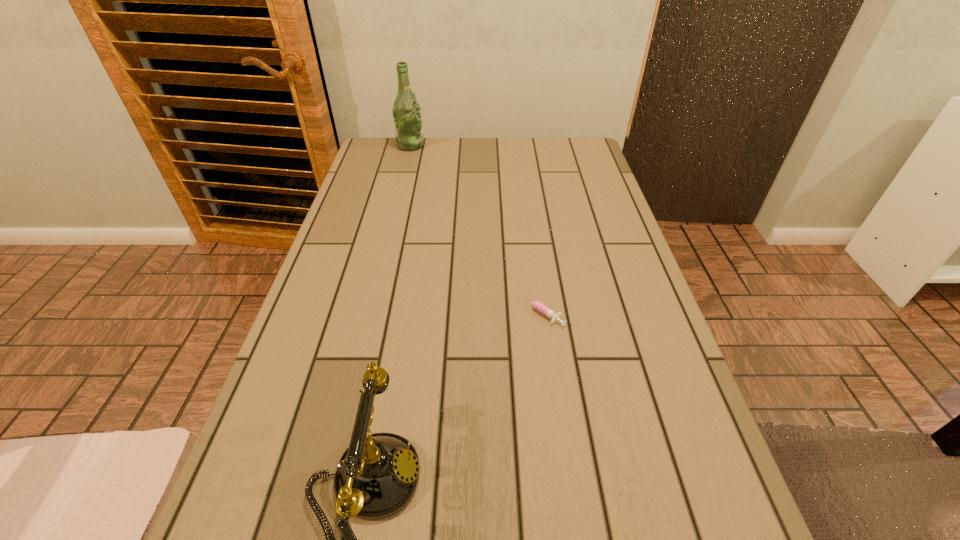
In the image, there is a desktop. Where is `vacant space at the left edge`? The height and width of the screenshot is (540, 960). vacant space at the left edge is located at coordinates (348, 266).

Find the location of a particular element. The image size is (960, 540). vacant space at the right edge of the desktop is located at coordinates (x=577, y=260).

In the image, there is a desktop. Where is `vacant space at the far left corner`? Image resolution: width=960 pixels, height=540 pixels. vacant space at the far left corner is located at coordinates (390, 138).

This screenshot has height=540, width=960. I want to click on unoccupied position between the farthest object and the shortest object, so click(x=476, y=228).

Where is `vacant area between the farthest object and the shortest object`? The image size is (960, 540). vacant area between the farthest object and the shortest object is located at coordinates (476, 228).

The image size is (960, 540). I want to click on vacant area that lies between the syringe and the beer bottle, so click(476, 228).

Where is `free spot between the farthest object and the syringe`? free spot between the farthest object and the syringe is located at coordinates (476, 228).

Identify which object is located as the nearest to the syringe. Please provide its 2D coordinates. Your answer should be formatted as a tuple, i.e. [(x, y)], where the tuple contains the x and y coordinates of a point satisfying the conditions above.

[(378, 474)]

Locate which object ranks second in proximity to the shortest object. Please provide its 2D coordinates. Your answer should be formatted as a tuple, i.e. [(x, y)], where the tuple contains the x and y coordinates of a point satisfying the conditions above.

[(406, 111)]

Where is `vacant position in the image that satisfies the following two spatial constraints: 1. on the back side of the shortest object; 2. on the surface of the tallest object`? Image resolution: width=960 pixels, height=540 pixels. vacant position in the image that satisfies the following two spatial constraints: 1. on the back side of the shortest object; 2. on the surface of the tallest object is located at coordinates (518, 145).